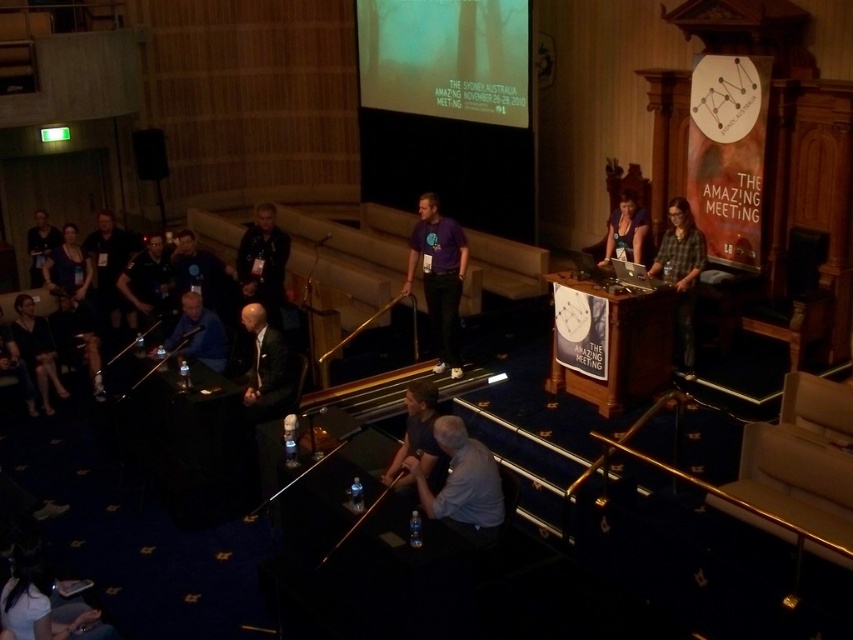
Does black suit at center have a smaller size compared to dark blue shirt at left?

Indeed, black suit at center has a smaller size compared to dark blue shirt at left.

Between point (276, 396) and point (33, 248), which one is positioned behind?

Positioned behind is point (33, 248).

Who is more forward, (254, 310) or (45, 243)?

→ Positioned in front is point (254, 310).

In order to click on black suit at center in this screenshot , I will do `click(267, 368)`.

Does gray fabric shirt at lower center appear on the right side of black fabric dress at lower left?

Yes, gray fabric shirt at lower center is to the right of black fabric dress at lower left.

What do you see at coordinates (462, 483) in the screenshot?
I see `gray fabric shirt at lower center` at bounding box center [462, 483].

Where is `gray fabric shirt at lower center`? gray fabric shirt at lower center is located at coordinates (462, 483).

Which of these two, purple cotton shirt at center or black suit at center, stands taller?

purple cotton shirt at center

Does point (448, 225) come farther from viewer compared to point (276, 368)?

Yes, point (448, 225) is behind point (276, 368).

Between point (421, 266) and point (273, 365), which one is positioned in front?

Point (273, 365)

The height and width of the screenshot is (640, 853). Find the location of `purple cotton shirt at center`. purple cotton shirt at center is located at coordinates (439, 276).